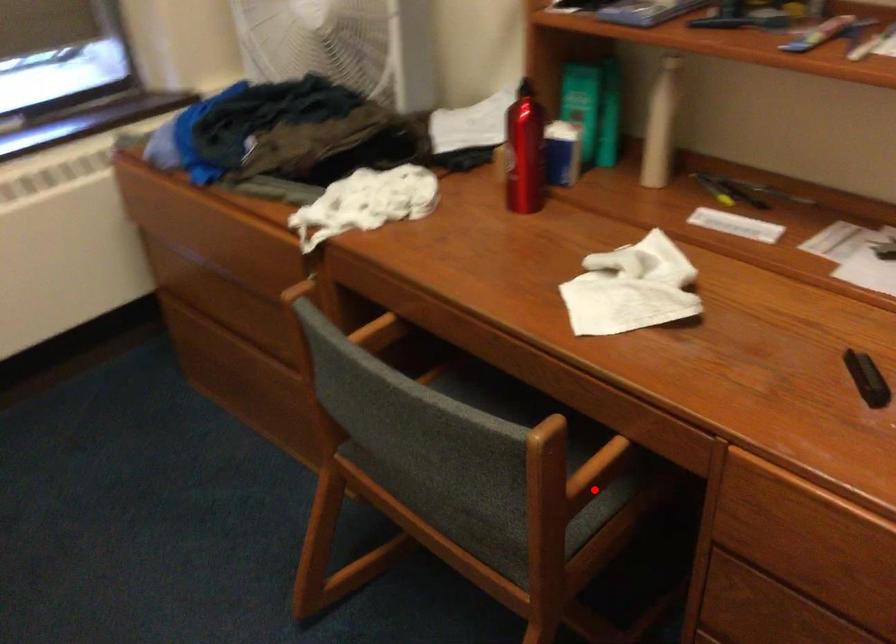
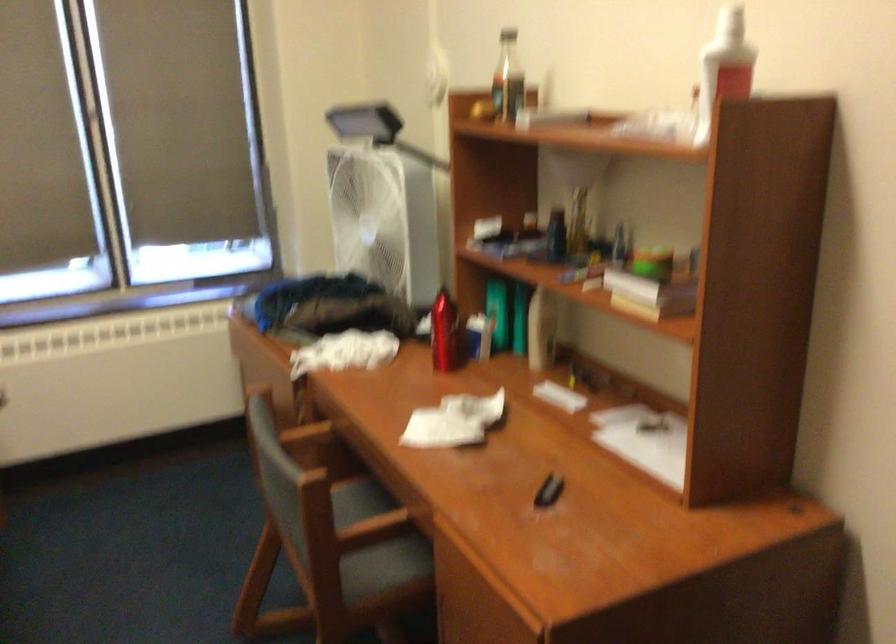
Where in the second image is the point corresponding to the highlighted location from the first image?

(375, 545)